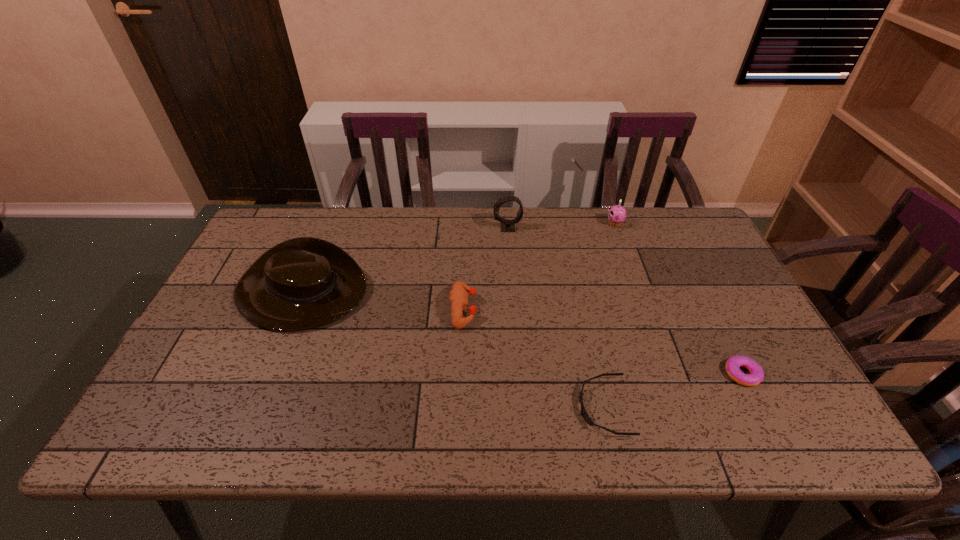
The height and width of the screenshot is (540, 960). Find the location of `vacant space located 0.050m on the front-facing side of the fourth object from left to right`. vacant space located 0.050m on the front-facing side of the fourth object from left to right is located at coordinates (558, 407).

Locate an element on the screen. This screenshot has height=540, width=960. watch that is positioned at the far edge is located at coordinates (506, 225).

The height and width of the screenshot is (540, 960). Find the location of `cupcake that is positioned at the far edge`. cupcake that is positioned at the far edge is located at coordinates (616, 214).

Identify the location of object that is positioned at the near edge. (586, 417).

Where is `object present at the left edge`? object present at the left edge is located at coordinates (302, 283).

Find the location of a particular element. object located in the right edge section of the desktop is located at coordinates (733, 364).

Identify the location of vacant area at the far edge of the desktop. (422, 244).

In order to click on vacant space at the near edge of the desktop in this screenshot , I will do coord(705,441).

Find the location of a particular element. This screenshot has width=960, height=540. vacant space at the left edge is located at coordinates pos(234,376).

In the image, there is a desktop. At what (x,y) coordinates should I click in order to perform the action: click on free region at the right edge. Please return your answer as a coordinate pair (x, y). This screenshot has width=960, height=540. Looking at the image, I should click on (678, 276).